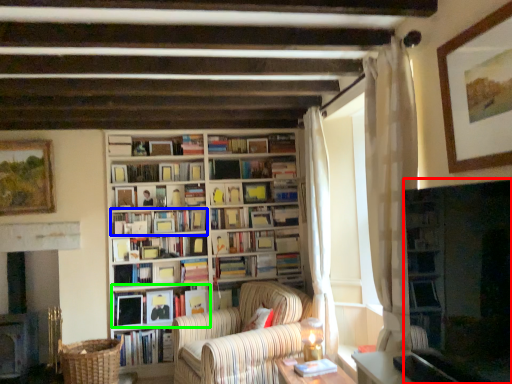
Question: Considering the real-world distances, which object is closest to shelf (highlighted by a red box)? book (highlighted by a blue box) or book (highlighted by a green box).

Choices:
 (A) book
 (B) book

Answer: (A)